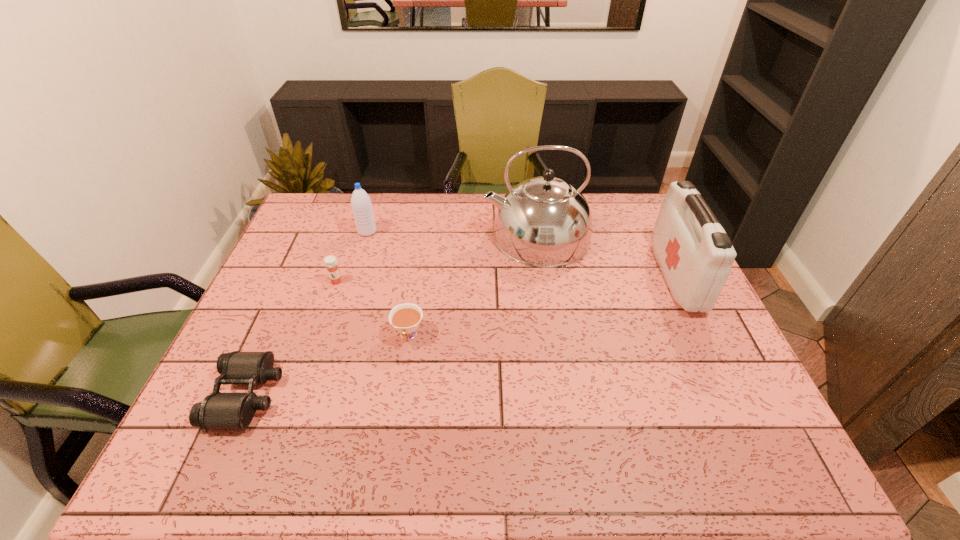
Find the location of `kettle positioned at the far edge`. kettle positioned at the far edge is located at coordinates (544, 221).

Locate an element on the screen. Image resolution: width=960 pixels, height=540 pixels. water bottle that is at the far edge is located at coordinates (361, 204).

The width and height of the screenshot is (960, 540). What are the coordinates of `object that is at the near edge` in the screenshot? It's located at (218, 410).

Locate an element on the screen. This screenshot has height=540, width=960. object that is at the left edge is located at coordinates (218, 410).

Image resolution: width=960 pixels, height=540 pixels. Identify the location of object at the right edge. (695, 255).

At what (x,y) coordinates should I click in order to perform the action: click on object situated at the near left corner. Please return your answer as a coordinate pair (x, y). Image resolution: width=960 pixels, height=540 pixels. Looking at the image, I should click on tap(218, 410).

You are a GUI agent. You are given a task and a screenshot of the screen. Output one action in this format:
    pyautogui.click(x=<x>, y=<y>)
    Task: Click on the vacant space at the far edge of the desktop
    The width and height of the screenshot is (960, 540).
    Given the screenshot: What is the action you would take?
    (423, 230)

I want to click on blank space at the near edge of the desktop, so click(x=469, y=453).

The width and height of the screenshot is (960, 540). Identify the location of free space at the left edge of the desktop. (294, 243).

In the image, there is a desktop. Where is `vacant space at the right edge`? vacant space at the right edge is located at coordinates tap(702, 343).